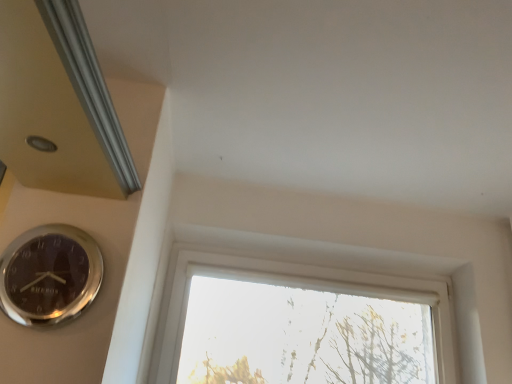
The height and width of the screenshot is (384, 512). Find the location of `silver metallic wall clock at lower left`. silver metallic wall clock at lower left is located at coordinates (49, 275).

What do you see at coordinates (49, 275) in the screenshot?
I see `silver metallic wall clock at lower left` at bounding box center [49, 275].

Measure the distance between point (25, 294) and camera.

The distance of point (25, 294) from camera is 3.79 feet.

What are the coordinates of `transparent glass window at center` in the screenshot? It's located at (294, 286).

Measure the distance between point [386,275] and camera.

The depth of point [386,275] is 2.16 meters.

What do you see at coordinates (294, 286) in the screenshot? This screenshot has height=384, width=512. I see `transparent glass window at center` at bounding box center [294, 286].

This screenshot has height=384, width=512. Find the location of `silver metallic wall clock at lower left`. silver metallic wall clock at lower left is located at coordinates (49, 275).

Would you say silver metallic wall clock at lower left is to the left or to the right of transparent glass window at center in the picture?

In the image, silver metallic wall clock at lower left appears on the left side of transparent glass window at center.

Which is in front, silver metallic wall clock at lower left or transparent glass window at center?

silver metallic wall clock at lower left is in front.

Considering the positions of point (4, 279) and point (174, 260), is point (4, 279) closer or farther from the camera than point (174, 260)?

Point (4, 279) is closer to the camera than point (174, 260).

From the image's perspective, which one is positioned higher, silver metallic wall clock at lower left or transparent glass window at center?

silver metallic wall clock at lower left.

From a real-world perspective, does silver metallic wall clock at lower left sit lower than transparent glass window at center?

Yes, from a real-world perspective, silver metallic wall clock at lower left is below transparent glass window at center.

Can you confirm if silver metallic wall clock at lower left is wider than transparent glass window at center?

Incorrect, the width of silver metallic wall clock at lower left does not surpass that of transparent glass window at center.

Is silver metallic wall clock at lower left taller or shorter than transparent glass window at center?

silver metallic wall clock at lower left is shorter than transparent glass window at center.

Considering the sizes of objects silver metallic wall clock at lower left and transparent glass window at center in the image provided, who is smaller, silver metallic wall clock at lower left or transparent glass window at center?

Smaller between the two is silver metallic wall clock at lower left.

From the picture: Is silver metallic wall clock at lower left outside of transparent glass window at center?

Absolutely, silver metallic wall clock at lower left is external to transparent glass window at center.

Is silver metallic wall clock at lower left not near transparent glass window at center?

silver metallic wall clock at lower left is near transparent glass window at center, not far away.

Is silver metallic wall clock at lower left facing away from transparent glass window at center?

silver metallic wall clock at lower left is not turned away from transparent glass window at center.

How much distance is there between silver metallic wall clock at lower left and transparent glass window at center?

The distance of silver metallic wall clock at lower left from transparent glass window at center is 37.89 inches.

Image resolution: width=512 pixels, height=384 pixels. In order to click on window on the right of silver metallic wall clock at lower left in this screenshot , I will do `click(294, 286)`.

Between transparent glass window at center and silver metallic wall clock at lower left, which one appears on the left side from the viewer's perspective?

silver metallic wall clock at lower left is more to the left.

Which is in front, transparent glass window at center or silver metallic wall clock at lower left?

silver metallic wall clock at lower left.

Which point is more forward, (277, 281) or (36, 295)?

Point (36, 295)

From the image's perspective, which one is positioned higher, transparent glass window at center or silver metallic wall clock at lower left?

From the image's view, silver metallic wall clock at lower left is above.

From a real-world perspective, is transparent glass window at center above or below silver metallic wall clock at lower left?

Clearly, from a real-world perspective, transparent glass window at center is above silver metallic wall clock at lower left.

Can you confirm if transparent glass window at center is wider than silver metallic wall clock at lower left?

Yes.

Is transparent glass window at center taller than silver metallic wall clock at lower left?

Indeed, transparent glass window at center has a greater height compared to silver metallic wall clock at lower left.

Is transparent glass window at center bigger than silver metallic wall clock at lower left?

Yes, transparent glass window at center is bigger than silver metallic wall clock at lower left.

Would you say transparent glass window at center is inside or outside silver metallic wall clock at lower left?

Result: transparent glass window at center cannot be found inside silver metallic wall clock at lower left.

Can you see transparent glass window at center touching silver metallic wall clock at lower left?

No, transparent glass window at center is not beside silver metallic wall clock at lower left.

Is transparent glass window at center looking in the opposite direction of silver metallic wall clock at lower left?

No.

Identify the location of window above the silver metallic wall clock at lower left (from a real-world perspective). (294, 286).

Image resolution: width=512 pixels, height=384 pixels. In order to click on wall clock located above the transparent glass window at center (from the image's perspective) in this screenshot , I will do `click(49, 275)`.

At what (x,y) coordinates should I click in order to perform the action: click on window that is above the silver metallic wall clock at lower left (from a real-world perspective). Please return your answer as a coordinate pair (x, y). The width and height of the screenshot is (512, 384). Looking at the image, I should click on (294, 286).